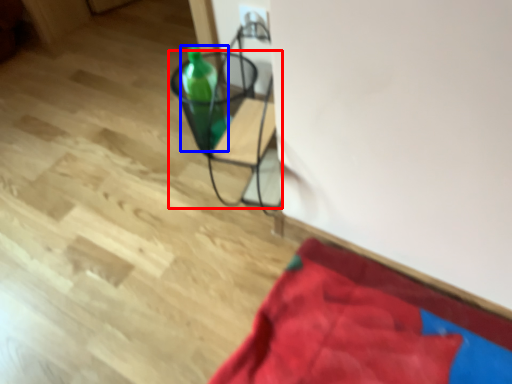
Question: Which of the following is the farthest to the observer, furniture (highlighted by a red box) or bottle (highlighted by a blue box)?

Choices:
 (A) furniture
 (B) bottle

Answer: (B)